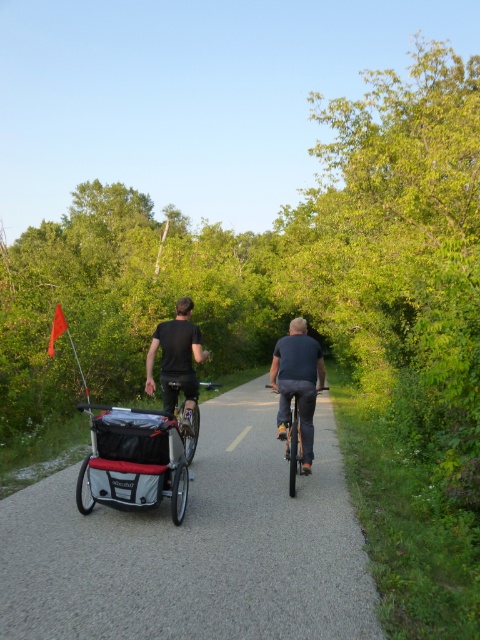
Can you confirm if black matte shirt at center is bigger than shiny black bicycle at center?

No.

Is point (166, 365) farther from viewer compared to point (292, 406)?

No, (166, 365) is closer to viewer.

Which is in front, point (183, 333) or point (294, 428)?

Point (294, 428) is more forward.

I want to click on black matte shirt at center, so click(177, 360).

Is silver metallic cart at center wider than black matte shirt at center?

Correct, the width of silver metallic cart at center exceeds that of black matte shirt at center.

Who is more forward, [99,406] or [178,304]?

Point [178,304] is more forward.

Is point (167, 440) positioned after point (184, 362)?

That is False.

This screenshot has width=480, height=640. What are the coordinates of `silver metallic cart at center` in the screenshot? It's located at (133, 460).

Who is shorter, silver metallic cart at center or dark blue fabric shirt at center?

silver metallic cart at center

This screenshot has height=640, width=480. What do you see at coordinates (133, 460) in the screenshot?
I see `silver metallic cart at center` at bounding box center [133, 460].

Is point (128, 483) positioned before point (314, 365)?

Yes.

This screenshot has height=640, width=480. Find the location of `silver metallic cart at center`. silver metallic cart at center is located at coordinates (133, 460).